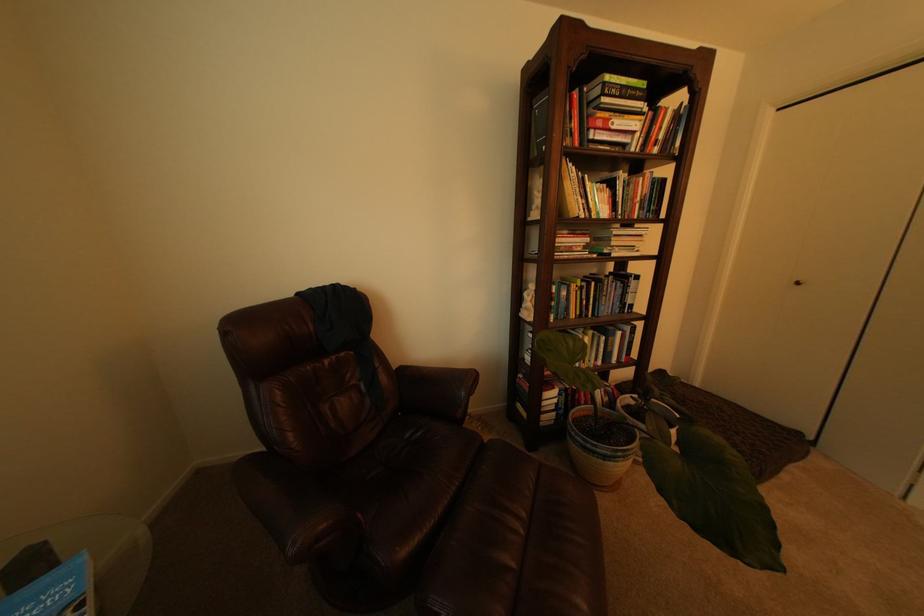
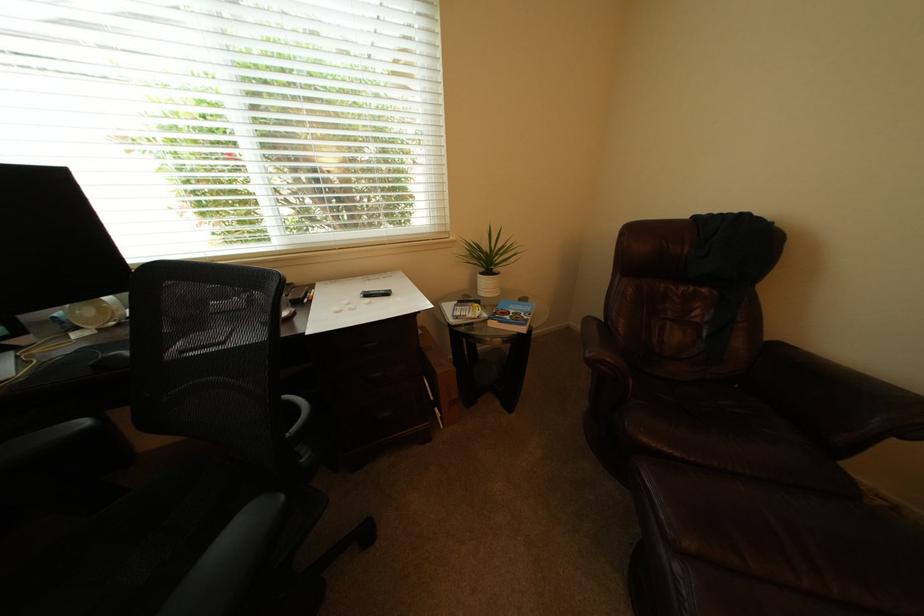
In the second image, find the point that corresponds to point (414, 554) in the first image.

(657, 440)